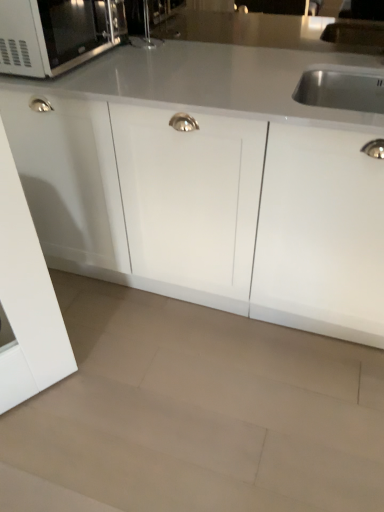
Image resolution: width=384 pixels, height=512 pixels. What are the coordinates of `vacant space situated above white glossy cabinet at center (from a real-world perspective)` in the screenshot? It's located at (215, 68).